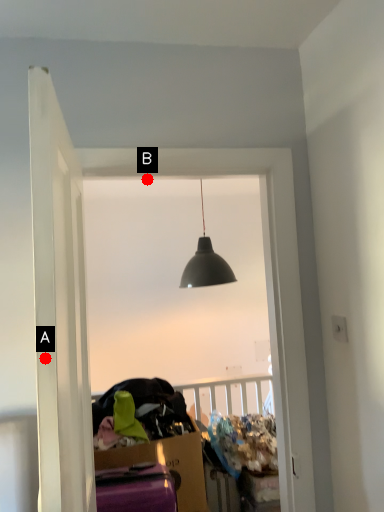
Question: Two points are circled on the image, labeled by A and B beside each circle. Which point appears closest to the camera in this image?

Choices:
 (A) A is closer
 (B) B is closer

Answer: (A)